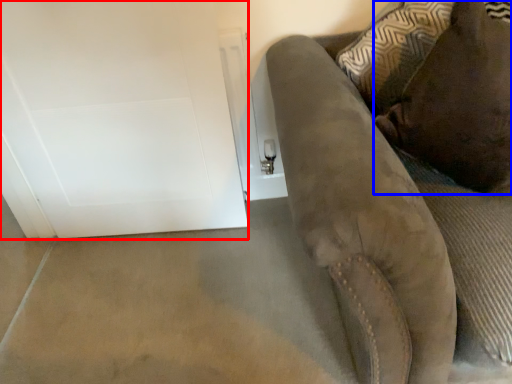
Question: Among these objects, which one is nearest to the camera, glass door (highlighted by a red box) or pillow (highlighted by a blue box)?

Choices:
 (A) glass door
 (B) pillow

Answer: (B)